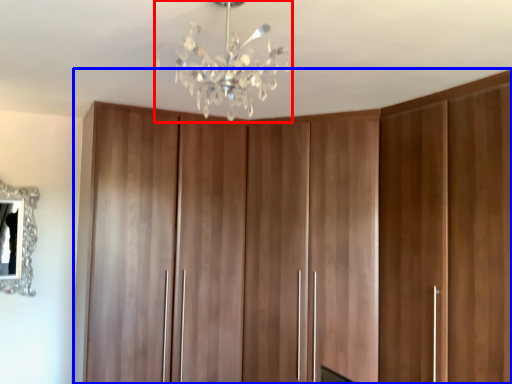
Question: Among these objects, which one is nearest to the camera, lamp (highlighted by a red box) or cupboard (highlighted by a blue box)?

Choices:
 (A) lamp
 (B) cupboard

Answer: (A)